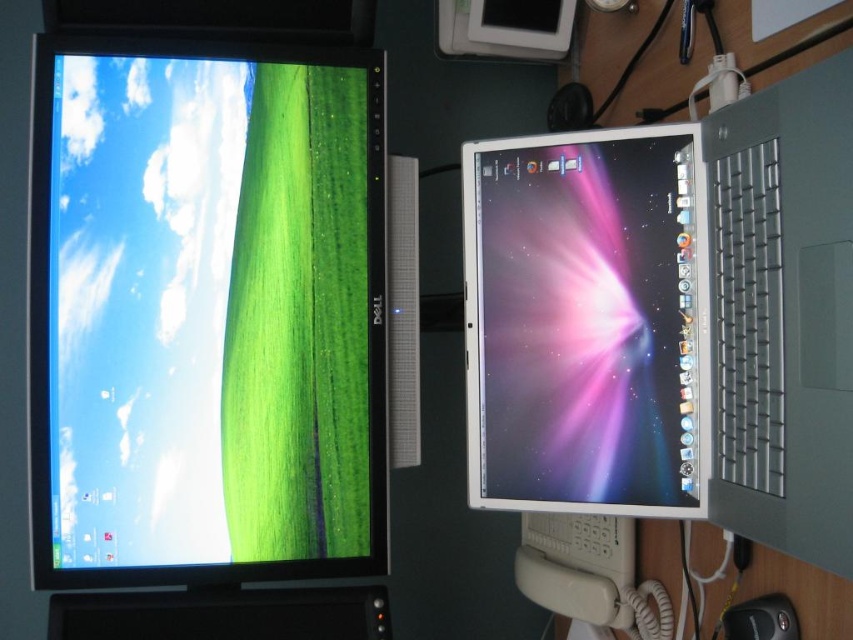
You are a photographer adjusting your camera to capture the workspace setup. You notice two points marked in the image. Which point, point (740, 461) or point (762, 602), is closer to your camera lens?

Point (740, 461) is closer to the camera than point (762, 602).

You are setting up a new workspace and want to place a Dell monitor and a MacBook Pro laptop in a way that aligns with their positions in the provided image. If the MacBook Pro laptop is placed to the right of the Dell monitor, which object corresponds to the coordinates point (206,314)?

The coordinates point (206,314) correspond to the matte black monitor at left, as stated in the Objects Description.

You are organizing cables for a tech setup. You need to place a new cable behind the satin silver laptop at right without blocking the black plastic mouse at lower right. Is this possible based on their positions?

The satin silver laptop at right is positioned over the black plastic mouse at lower right, so placing a cable behind the laptop would also block the mouse since they are in the same location.